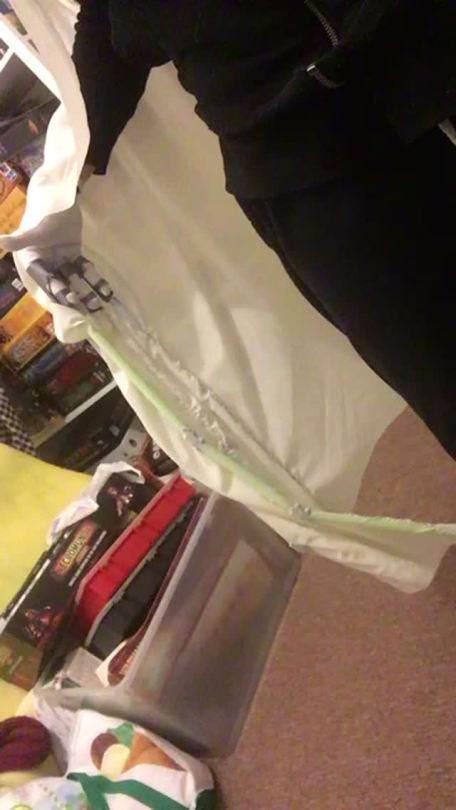
The image size is (456, 810). Identify the location of yellow wall. (10, 531).